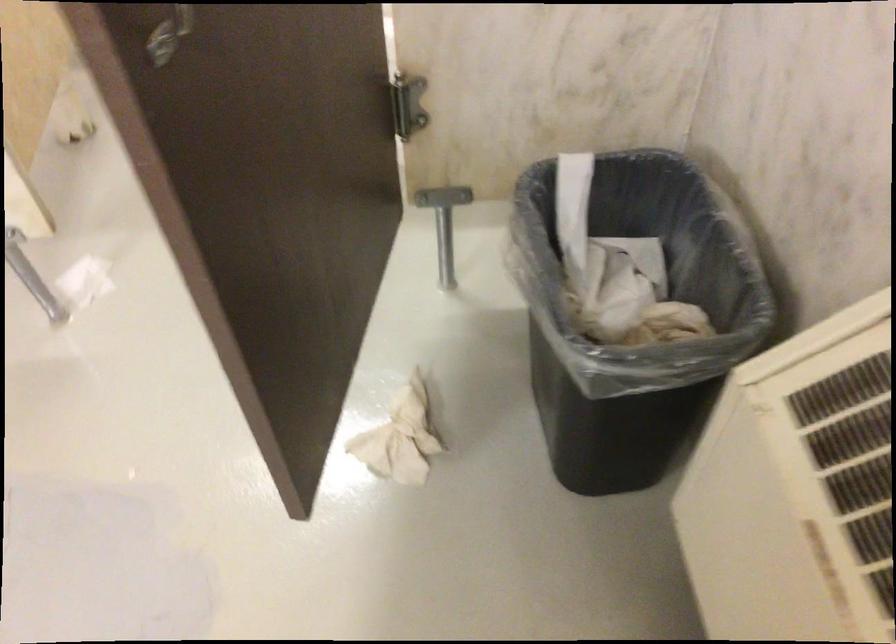
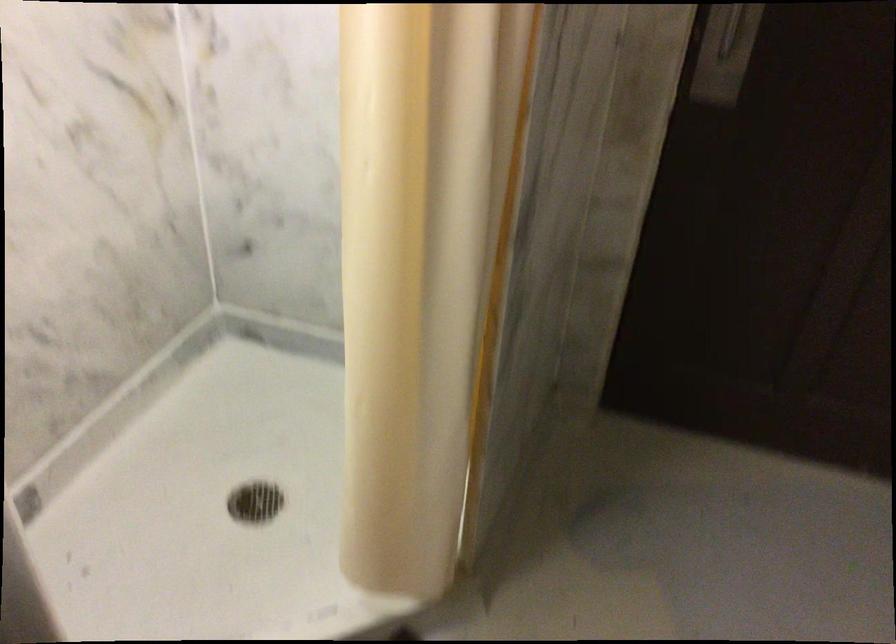
How did the camera likely rotate?

The camera's rotation is toward left-down.